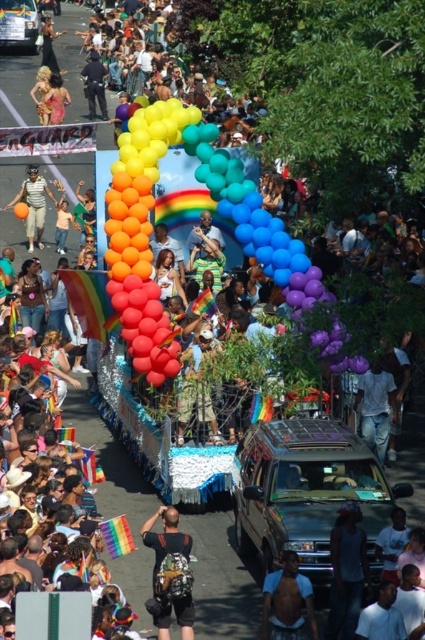
You are a photographer at the Pride parade trying to capture a photo of the float. You notice the matte gold bikini at upper left and the matte black shirt at center. Which object is shorter in height?

The matte gold bikini at upper left has a lesser height compared to the matte black shirt at center, so the matte gold bikini at upper left is shorter in height.

In the scene shown: You are a photographer standing at the center of the Pride parade scene. You want to capture a photo of the matte gold bikini at upper left. Based on its 2D coordinates, in which general direction should you point your camera?

The matte gold bikini at upper left is located at coordinates point (56,99), which corresponds to the upper left area of the image. To capture it, you should point your camera towards the upper left direction.

You are a photographer trying to capture the Pride parade float. You notice two people in the crowd wearing a dark blue fabric shirt at lower right and a black leather jacket at upper left. Which person should you focus on to get a clearer photo?

The dark blue fabric shirt at lower right is closer to the viewer than the black leather jacket at upper left, so focusing on the dark blue fabric shirt at lower right will result in a clearer photo.